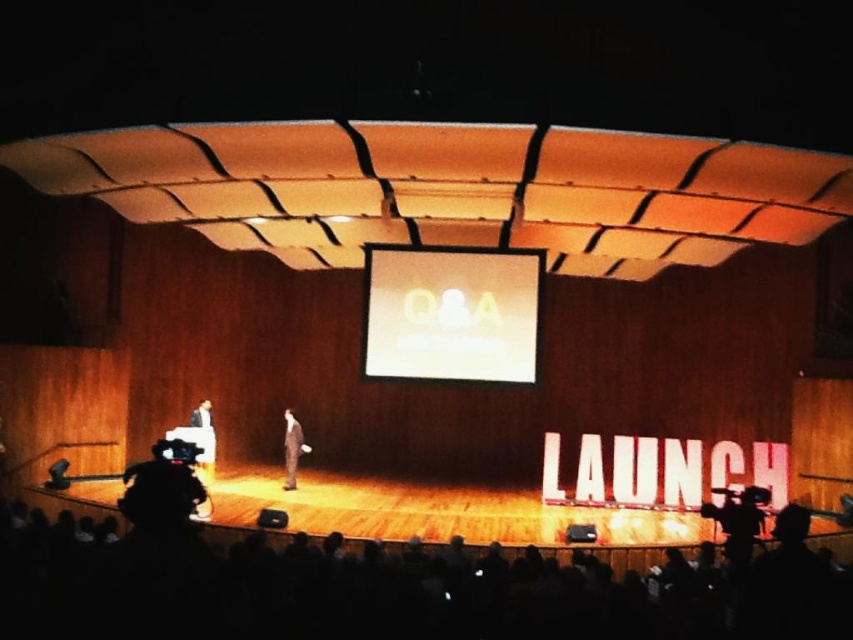
Question: Is light brown suit at left smaller than light brown leather jacket at left?

Choices:
 (A) yes
 (B) no

Answer: (B)

Question: Which object is the farthest from the dark suit at center?

Choices:
 (A) light brown suit at left
 (B) white glossy screen at center

Answer: (B)

Question: Which point is closer to the camera?

Choices:
 (A) light brown suit at left
 (B) light brown leather jacket at left
 (C) dark suit at center

Answer: (C)

Question: From the image, what is the correct spatial relationship of dark suit at center in relation to light brown leather jacket at left?

Choices:
 (A) left
 (B) right

Answer: (B)

Question: Does white glossy screen at center appear under light brown suit at left?

Choices:
 (A) yes
 (B) no

Answer: (B)

Question: Which object is closer to the camera taking this photo?

Choices:
 (A) white glossy screen at center
 (B) light brown suit at left
 (C) dark suit at center

Answer: (A)